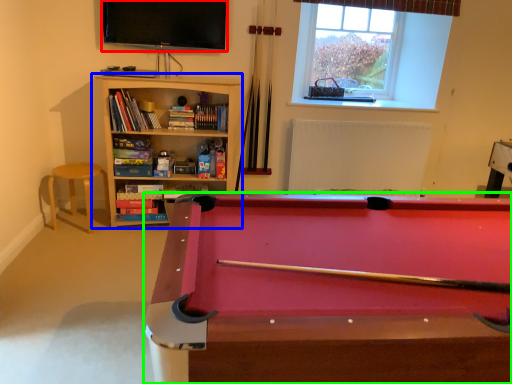
Question: Considering the real-world distances, which object is closest to television (highlighted by a red box)? bookcase (highlighted by a blue box) or billiard table (highlighted by a green box).

Choices:
 (A) bookcase
 (B) billiard table

Answer: (A)